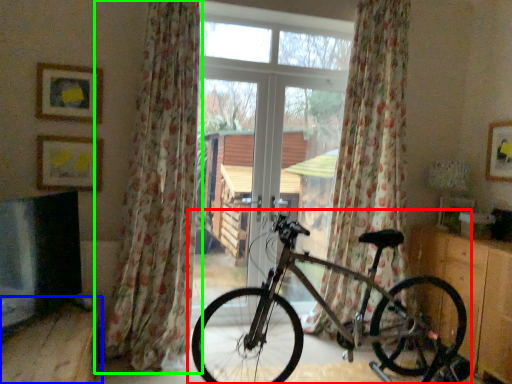
Question: Considering the real-world distances, which object is closest to bicycle (highlighted by a red box)? furniture (highlighted by a blue box) or curtain (highlighted by a green box).

Choices:
 (A) furniture
 (B) curtain

Answer: (B)